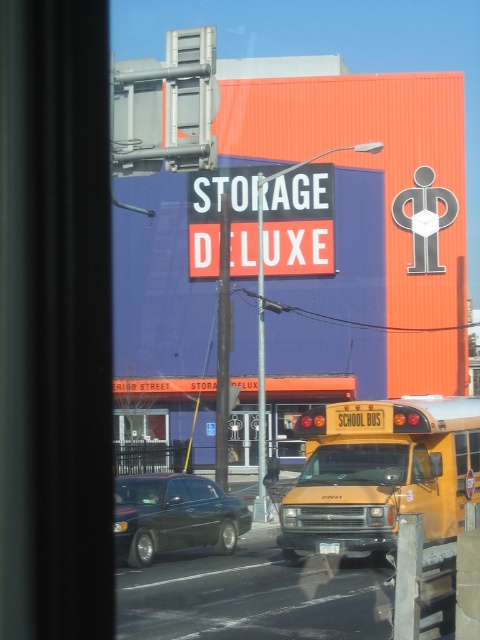
Locate an element on the screen. yellow matte/solid school bus at center is located at coordinates (381, 474).

The height and width of the screenshot is (640, 480). Describe the element at coordinates (381, 474) in the screenshot. I see `yellow matte/solid school bus at center` at that location.

Where is `yellow matte/solid school bus at center`? The image size is (480, 640). yellow matte/solid school bus at center is located at coordinates (381, 474).

I want to click on red matte sign at center, so click(300, 221).

Does red matte sign at center appear on the right side of shiny black sedan at lower left?

Correct, you'll find red matte sign at center to the right of shiny black sedan at lower left.

Does point (300, 212) come farther from viewer compared to point (224, 522)?

Yes, point (300, 212) is farther from viewer.

You are a GUI agent. You are given a task and a screenshot of the screen. Output one action in this format:
    pyautogui.click(x=<x>, y=<y>)
    Task: Click on the red matte sign at center
    
    Given the screenshot: What is the action you would take?
    pyautogui.click(x=300, y=221)

Does yellow matte/solid school bus at center appear on the left side of shiny black sedan at lower left?

In fact, yellow matte/solid school bus at center is to the right of shiny black sedan at lower left.

Who is positioned more to the left, yellow matte/solid school bus at center or shiny black sedan at lower left?

shiny black sedan at lower left is more to the left.

Which is in front, point (337, 474) or point (130, 476)?

Point (337, 474) is more forward.

Where is `yellow matte/solid school bus at center`? Image resolution: width=480 pixels, height=640 pixels. yellow matte/solid school bus at center is located at coordinates (381, 474).